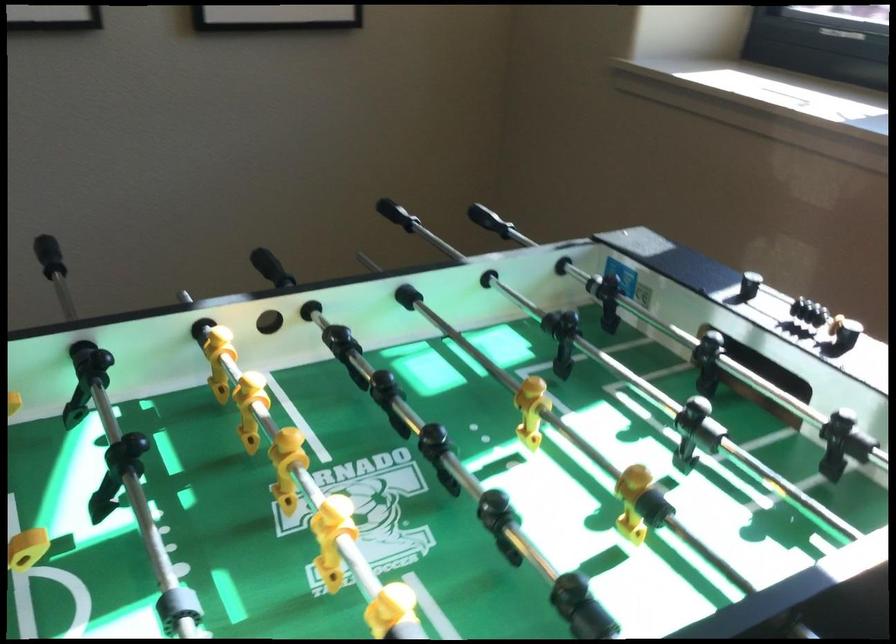
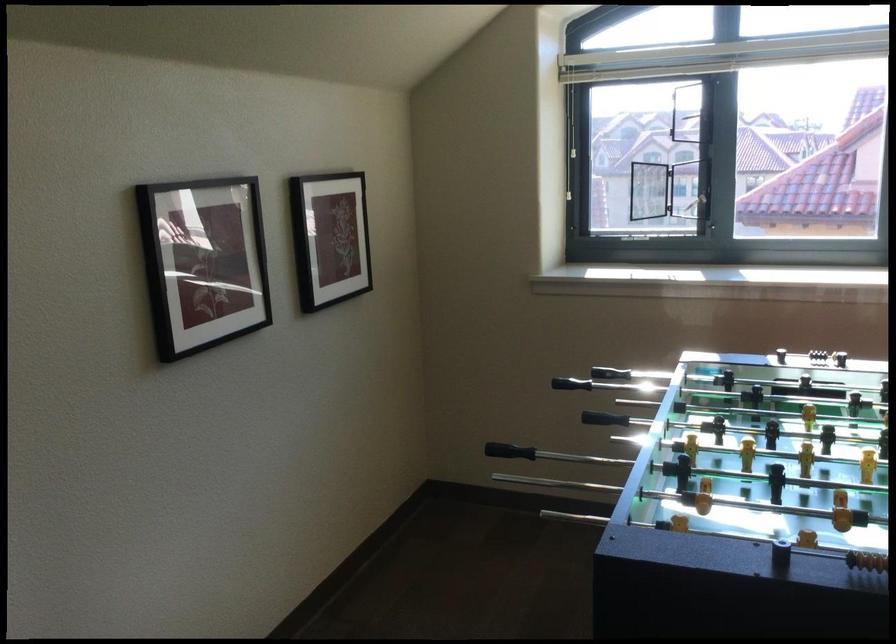
Locate, in the second image, the point that corresponds to the point at 798,307 in the first image.

(806, 351)